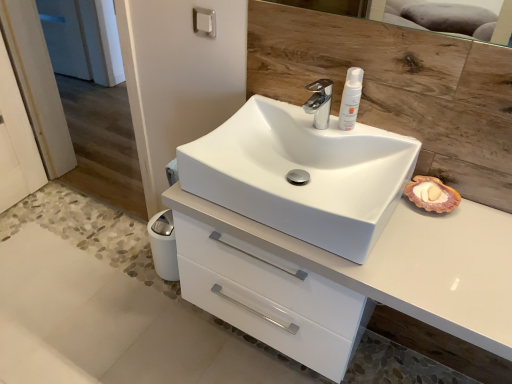
Locate an element on the screen. chrome metallic faucet at center is located at coordinates (319, 102).

The height and width of the screenshot is (384, 512). In order to click on white matte lotion at upper center in this screenshot , I will do `click(350, 98)`.

Could you tell me if chrome metallic faucet at center is facing white glossy sink at center?

No, chrome metallic faucet at center is not turned towards white glossy sink at center.

Can you confirm if chrome metallic faucet at center is wider than white glossy sink at center?

No, chrome metallic faucet at center is not wider than white glossy sink at center.

Looking at this image, is chrome metallic faucet at center situated inside white glossy sink at center or outside?

The correct answer is: outside.

Considering the relative positions of white glossy sink at center and white glossy cabinet at center in the image provided, is white glossy sink at center behind white glossy cabinet at center?

Yes, it is behind white glossy cabinet at center.

Is white glossy sink at center bigger or smaller than white glossy cabinet at center?

Clearly, white glossy sink at center is smaller in size than white glossy cabinet at center.

Which object is positioned more to the left, white glossy sink at center or white glossy cabinet at center?

white glossy sink at center.

Is white glossy cabinet at center inside white glossy sink at center?

That's incorrect, white glossy cabinet at center is not inside white glossy sink at center.

Considering the positions of objects white glossy cabinet at center and chrome metallic faucet at center in the image provided, who is more to the right, white glossy cabinet at center or chrome metallic faucet at center?

Positioned to the right is white glossy cabinet at center.

From a real-world perspective, is white glossy cabinet at center above or below chrome metallic faucet at center?

From a real-world perspective, white glossy cabinet at center is physically below chrome metallic faucet at center.

Is chrome metallic faucet at center at the back of white glossy cabinet at center?

No, white glossy cabinet at center's orientation is not away from chrome metallic faucet at center.

Between satin nickel towel bar at upper center and white glossy cabinet at center, which one has smaller size?

With smaller size is satin nickel towel bar at upper center.

Is satin nickel towel bar at upper center facing away from white glossy cabinet at center?

No, satin nickel towel bar at upper center's orientation is not away from white glossy cabinet at center.

Which is further, (209, 33) or (462, 269)?

The point (209, 33) is farther from the camera.

Could you tell me if chrome metallic faucet at center is turned towards satin nickel towel bar at upper center?

No, chrome metallic faucet at center is not facing towards satin nickel towel bar at upper center.

Looking at this image, is chrome metallic faucet at center far away from satin nickel towel bar at upper center?

They are positioned close to each other.

Based on the photo, is chrome metallic faucet at center taller or shorter than satin nickel towel bar at upper center?

Considering their sizes, chrome metallic faucet at center has more height than satin nickel towel bar at upper center.

Considering the positions of point (324, 120) and point (195, 30), is point (324, 120) closer or farther from the camera than point (195, 30)?

Point (324, 120).

In order to click on tap above the white glossy cabinet at center (from a real-world perspective) in this screenshot , I will do `click(319, 102)`.

Considering the points (329, 112) and (272, 239), which point is in front, point (329, 112) or point (272, 239)?

The point (272, 239) is closer.

Is chrome metallic faucet at center taller than white glossy cabinet at center?

No.

From a real-world perspective, which is physically above, chrome metallic faucet at center or white glossy cabinet at center?

chrome metallic faucet at center is physically above.

Who is taller, white matte lotion at upper center or white glossy cabinet at center?

With more height is white glossy cabinet at center.

Is white glossy cabinet at center surrounded by white matte lotion at upper center?

No, white matte lotion at upper center does not contain white glossy cabinet at center.

From the picture: Which point is more distant from viewer, (345, 100) or (313, 260)?

The point (345, 100) is more distant.

You are a GUI agent. You are given a task and a screenshot of the screen. Output one action in this format:
    pyautogui.click(x=<x>, y=<y>)
    Task: Click on the tap above the white glossy sink at center (from the image's perspective)
    This screenshot has width=512, height=384.
    Given the screenshot: What is the action you would take?
    pyautogui.click(x=319, y=102)

Find the location of a particular element. bathroom cabinet lying below the white glossy sink at center (from the image's perspective) is located at coordinates (384, 259).

Which object lies nearer to the anchor point white glossy sink at center, chrome metallic faucet at center or white matte lotion at upper center?

chrome metallic faucet at center lies closer to white glossy sink at center than the other object.

Based on their spatial positions, is chrome metallic faucet at center or white glossy sink at center closer to white matte lotion at upper center?

The object closer to white matte lotion at upper center is chrome metallic faucet at center.

Estimate the real-world distances between objects in this image. Which object is closer to white glossy cabinet at center, white matte lotion at upper center or white glossy sink at center?

white glossy sink at center is positioned closer to the anchor white glossy cabinet at center.

When comparing their distances from white matte lotion at upper center, does white glossy sink at center or satin nickel towel bar at upper center seem closer?

Among the two, white glossy sink at center is located nearer to white matte lotion at upper center.

Based on the photo, which object lies further to the anchor point white glossy sink at center, white glossy cabinet at center or satin nickel towel bar at upper center?

Based on the image, satin nickel towel bar at upper center appears to be further to white glossy sink at center.

When comparing their distances from white glossy cabinet at center, does white glossy sink at center or satin nickel towel bar at upper center seem further?

Among the two, satin nickel towel bar at upper center is located further to white glossy cabinet at center.

From the image, which object appears to be nearer to chrome metallic faucet at center, satin nickel towel bar at upper center or white glossy cabinet at center?

Among the two, satin nickel towel bar at upper center is located nearer to chrome metallic faucet at center.

When comparing their distances from white glossy sink at center, does satin nickel towel bar at upper center or white matte lotion at upper center seem closer?

white matte lotion at upper center is closer to white glossy sink at center.

This screenshot has height=384, width=512. I want to click on toiletry between satin nickel towel bar at upper center and white glossy cabinet at center in the up-down direction, so click(x=350, y=98).

What are the coordinates of `tap between satin nickel towel bar at upper center and white glossy sink at center from top to bottom` in the screenshot? It's located at (319, 102).

Locate an element on the screen. Image resolution: width=512 pixels, height=384 pixels. tap between white matte lotion at upper center and white glossy cabinet at center vertically is located at coordinates (319, 102).

I want to click on tap situated between satin nickel towel bar at upper center and white matte lotion at upper center from left to right, so click(319, 102).